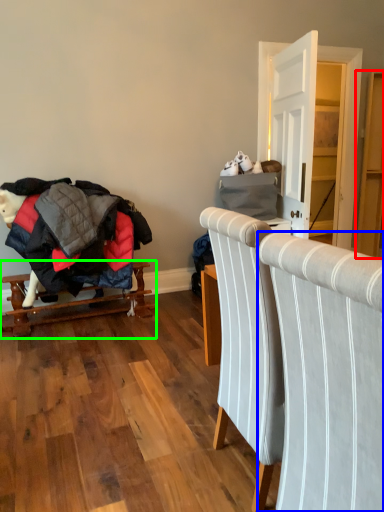
Question: Based on their relative distances, which object is nearer to dresser (highlighted by a red box)? Choose from chair (highlighted by a blue box) and furniture (highlighted by a green box).

Choices:
 (A) chair
 (B) furniture

Answer: (B)